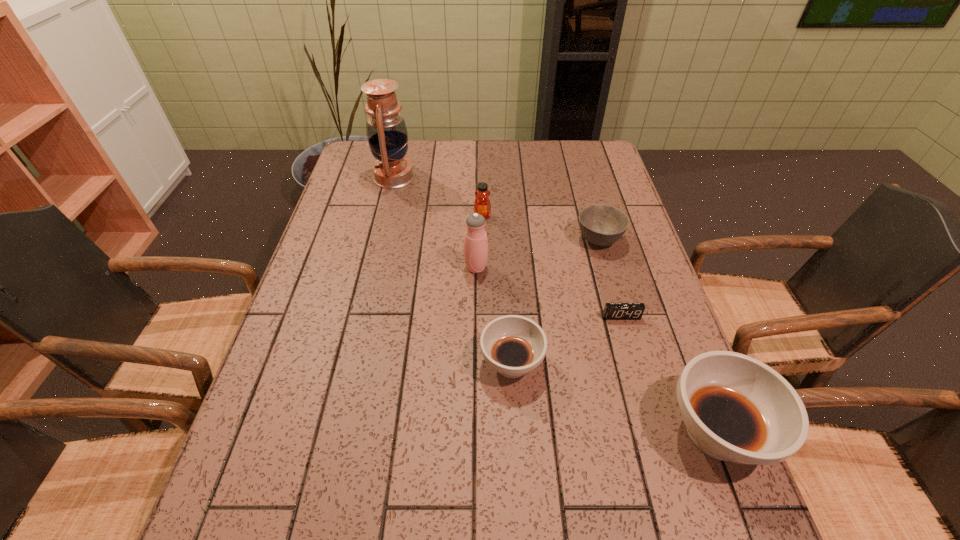
Identify the location of object present at the left edge. Image resolution: width=960 pixels, height=540 pixels. (386, 130).

Locate an element on the screen. The image size is (960, 540). soup bowl that is at the right edge is located at coordinates (735, 408).

Where is `bowl located in the right edge section of the desktop`? The width and height of the screenshot is (960, 540). bowl located in the right edge section of the desktop is located at coordinates [x=601, y=225].

You are a GUI agent. You are given a task and a screenshot of the screen. Output one action in this format:
    pyautogui.click(x=<x>, y=<y>)
    Task: Click on the alarm clock that is at the right edge
    The image size is (960, 540).
    Given the screenshot: What is the action you would take?
    pyautogui.click(x=612, y=311)

Locate an element on the screen. object situated at the far left corner is located at coordinates (386, 130).

Identify the location of object situated at the near right corner. The height and width of the screenshot is (540, 960). (735, 408).

I want to click on free space at the far edge of the desktop, so click(444, 144).

Find the location of a particular element. blank area at the near edge is located at coordinates (622, 448).

Find the location of a particular element. vacant space at the left edge of the desktop is located at coordinates (376, 201).

Identify the location of vacant area at the right edge. (606, 196).